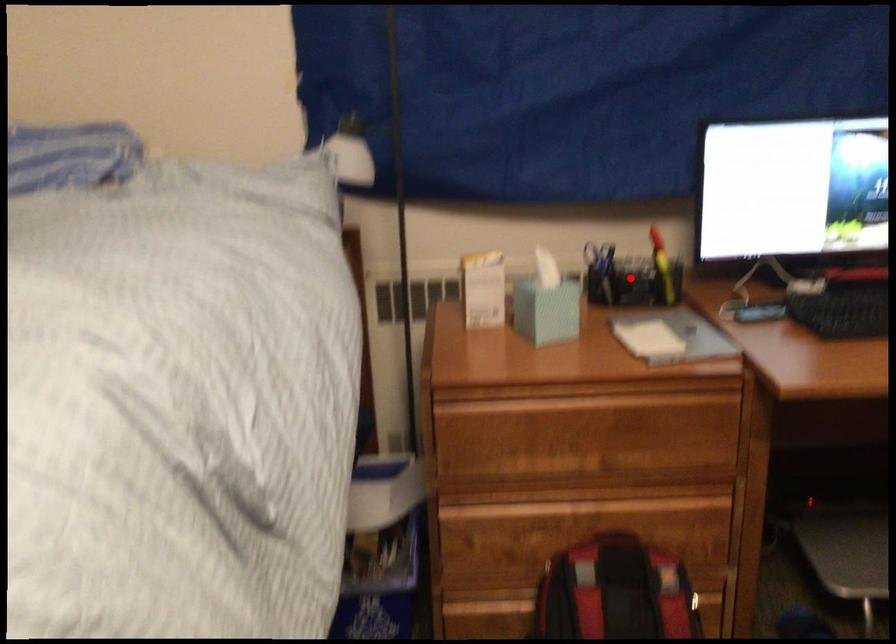
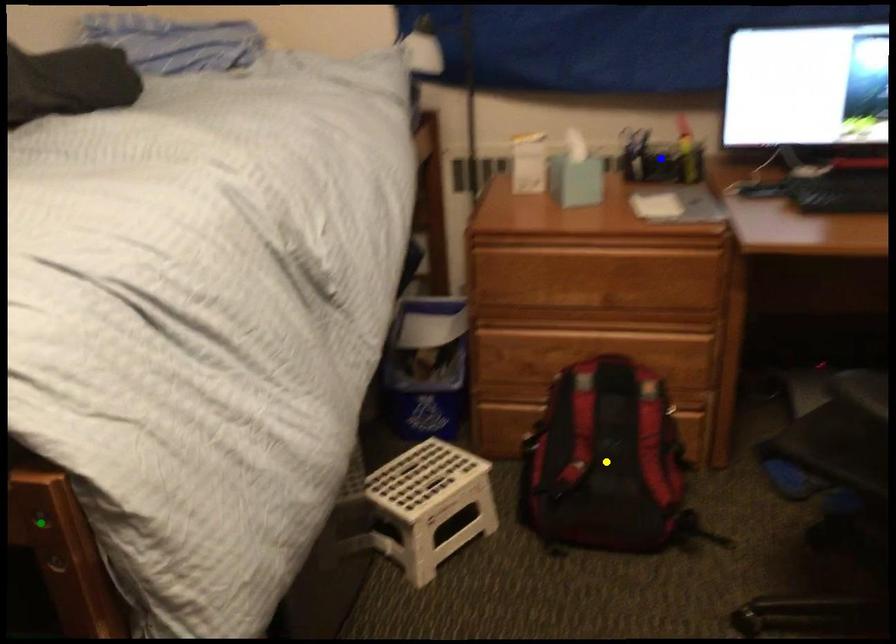
Question: I am providing you with two images of the same scene from different viewpoints. A red point is marked on the first image. You are given multiple points on the second image. Can you choose the point in image 2 that corresponds to the point in image 1?

Choices:
 (A) blue point
 (B) yellow point
 (C) green point

Answer: (A)